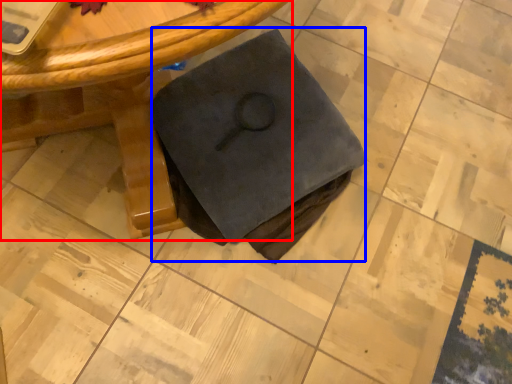
Question: Which object is further to the camera taking this photo, table (highlighted by a red box) or fabric (highlighted by a blue box)?

Choices:
 (A) table
 (B) fabric

Answer: (B)